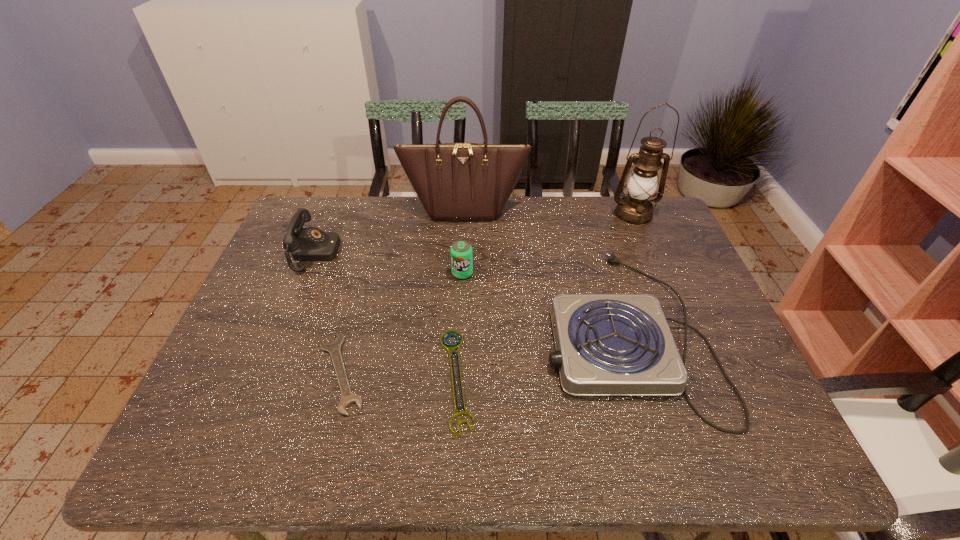
In the image, there is a desktop. Where is `free space at the right edge`? Image resolution: width=960 pixels, height=540 pixels. free space at the right edge is located at coordinates (640, 265).

Identify the location of vacant region at the far left corner of the desktop. (337, 203).

In the image, there is a desktop. Where is `blank space at the far right corner`? The image size is (960, 540). blank space at the far right corner is located at coordinates (668, 230).

You are a GUI agent. You are given a task and a screenshot of the screen. Output one action in this format:
    pyautogui.click(x=<x>, y=<y>)
    Task: Click on the vacant space that's between the right wrench and the handbag
    The image size is (960, 540).
    Given the screenshot: What is the action you would take?
    pyautogui.click(x=461, y=294)

You are a GUI agent. You are given a task and a screenshot of the screen. Output one action in this format:
    pyautogui.click(x=<x>, y=<y>)
    Task: Click on the empty space that is in between the left wrench and the leftmost object
    
    Given the screenshot: What is the action you would take?
    pyautogui.click(x=328, y=313)

This screenshot has width=960, height=540. Identify the location of vacant area between the right wrench and the third shortest object. (541, 355).

The height and width of the screenshot is (540, 960). What are the coordinates of `free area in between the oil lamp and the pop soda` in the screenshot? It's located at (548, 244).

Identify the location of blank region between the right wrench and the left wrench. (398, 376).

In order to click on empty space between the hotplate and the handbag in this screenshot , I will do `click(545, 270)`.

Find the location of a particular element. This screenshot has width=960, height=540. empty space that is in between the leftmost object and the right wrench is located at coordinates (386, 316).